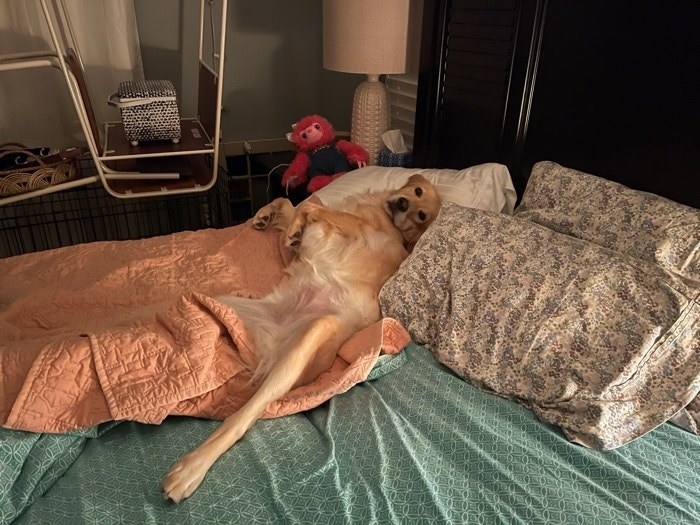
Where is `white pillow`? The width and height of the screenshot is (700, 525). white pillow is located at coordinates (470, 188).